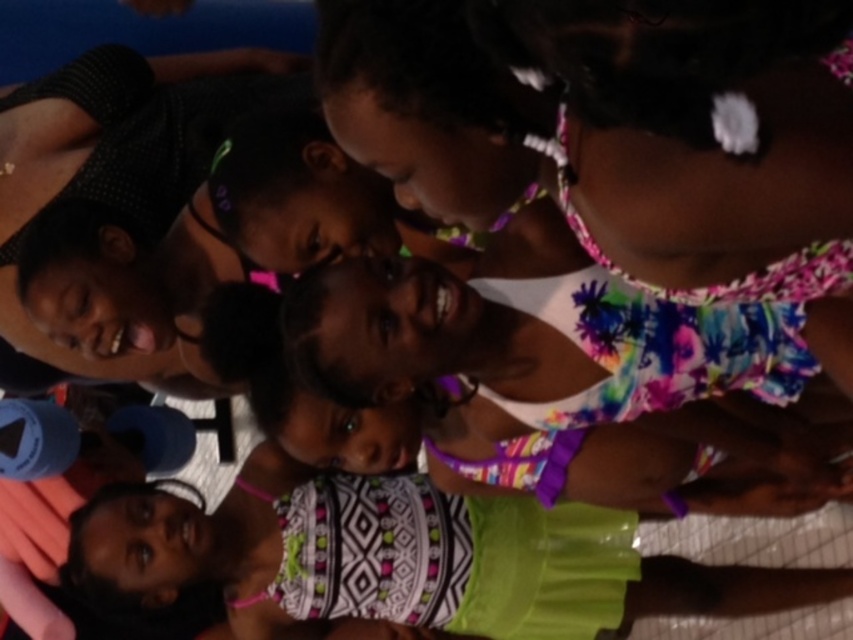
Is point (59, 353) positioned behind point (173, 502)?

No, (59, 353) is in front of (173, 502).

Which is more to the left, matte black hair at upper left or patterned fabric dress at lower left?

Positioned to the left is matte black hair at upper left.

At what (x,y) coordinates should I click in order to perform the action: click on matte black hair at upper left. Please return your answer as a coordinate pair (x, y). Image resolution: width=853 pixels, height=640 pixels. Looking at the image, I should click on (123, 179).